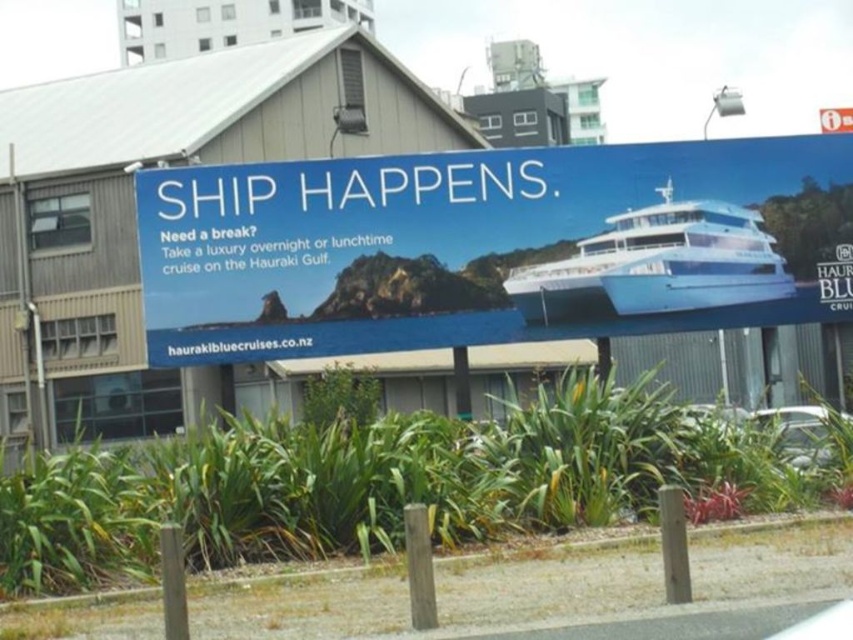
You are a graphic designer working on a billboard layout. You need to place a new element at position coordinates that are exactly 0.1 units to the right of the white glossy ship at upper center. What are the new coordinates for this position?

The white glossy ship at upper center is located at coordinates (492, 246). Moving 0.1 units to the right would add 0.1 to the x coordinate, resulting in new coordinates of (492, 310).

You are standing on the street looking at the billboard. Which object, the white glossy ship at upper center or the white glossy boat at upper right, appears to be in front of the other?

The white glossy ship at upper center is positioned over the white glossy boat at upper right, so the ship appears to be in front of the boat.

You are a graphic designer reviewing the billboard layout. You need to ensure that the white glossy ship at upper center and the white glossy boat at upper right are proportionally sized. According to the design specifications, the ship should be twice as large as the boat. Does the current layout meet this requirement?

The white glossy ship at upper center has a larger size compared to the white glossy boat at upper right. However, the description only states that the ship is larger, not specifically twice as large. Therefore, the current layout may not fully meet the requirement unless the exact size ratio is confirmed.